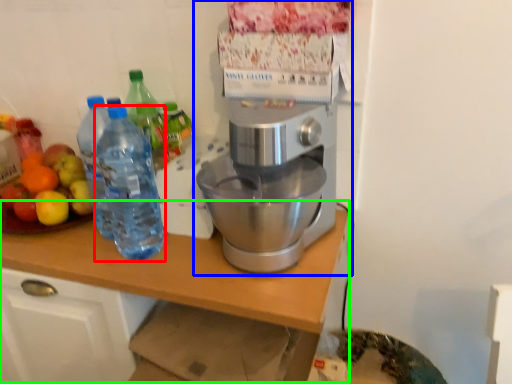
Question: Estimate the real-world distances between objects in this image. Which object is closer to bottle (highlighted by a red box), coffee maker (highlighted by a blue box) or table (highlighted by a green box)?

Choices:
 (A) coffee maker
 (B) table

Answer: (B)